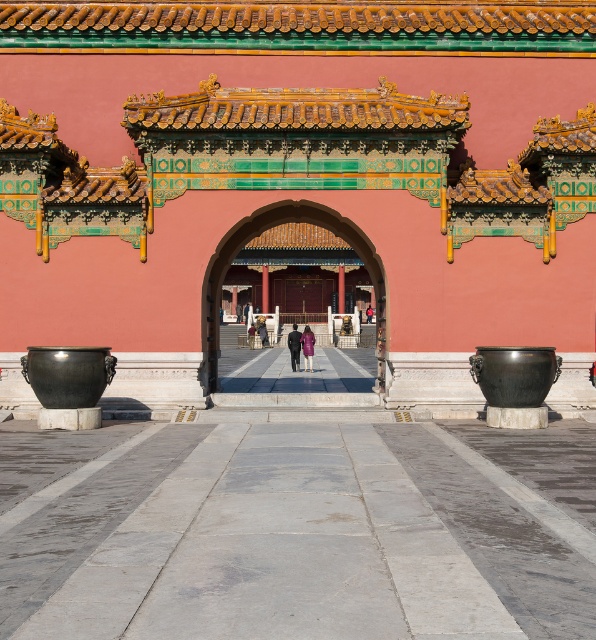
In the scene shown: Measure the distance between point (303, 348) and camera.

They are 30.83 meters apart.

In order to click on purple matte coat at center in this screenshot , I will do `click(308, 346)`.

Is polished bronze gate at center bigger than dark purple coat at center?

Indeed, polished bronze gate at center has a larger size compared to dark purple coat at center.

Does polished bronze gate at center have a lesser width compared to dark purple coat at center?

In fact, polished bronze gate at center might be wider than dark purple coat at center.

Where is `polished bronze gate at center`? This screenshot has width=596, height=640. polished bronze gate at center is located at coordinates (299, 179).

Who is more forward, (299, 339) or (260, 321)?

Point (299, 339)

Who is taller, dark blue fabric coat at center or dark purple coat at center?

Standing taller between the two is dark blue fabric coat at center.

What do you see at coordinates (294, 346) in the screenshot?
I see `dark blue fabric coat at center` at bounding box center [294, 346].

Where is `dark blue fabric coat at center`? dark blue fabric coat at center is located at coordinates (294, 346).